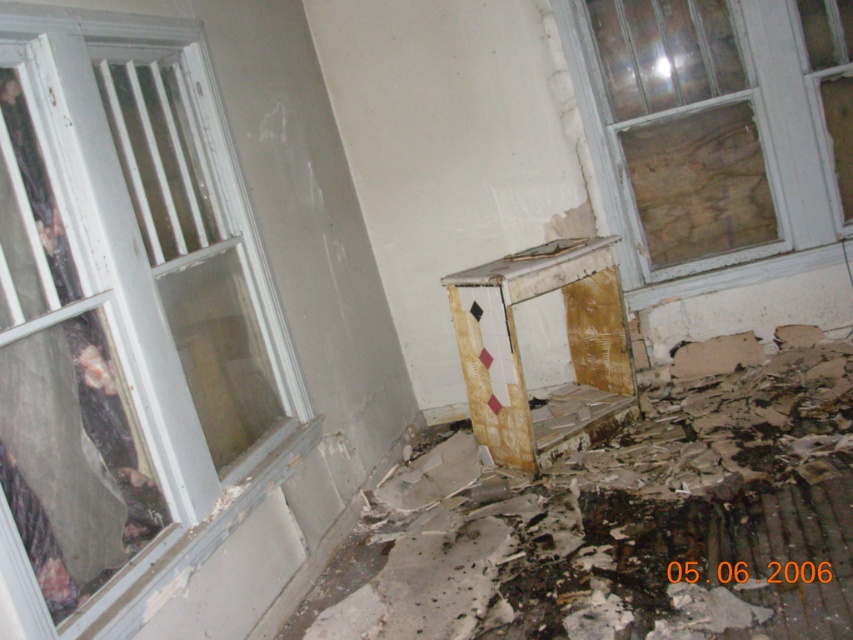
You are an inspector assessing the structural integrity of this abandoned building. You notice the white painted wood window at left and the transparent glass window at upper right. Which window is located to the left of the other?

The white painted wood window at left is positioned on the left side of transparent glass window at upper right.

You are an inspector assessing the structural integrity of the building. You notice the white painted wood window at left and the transparent glass window at upper right. Which window is positioned higher up in the wall?

The transparent glass window at upper right is positioned higher up in the wall than the white painted wood window at left.